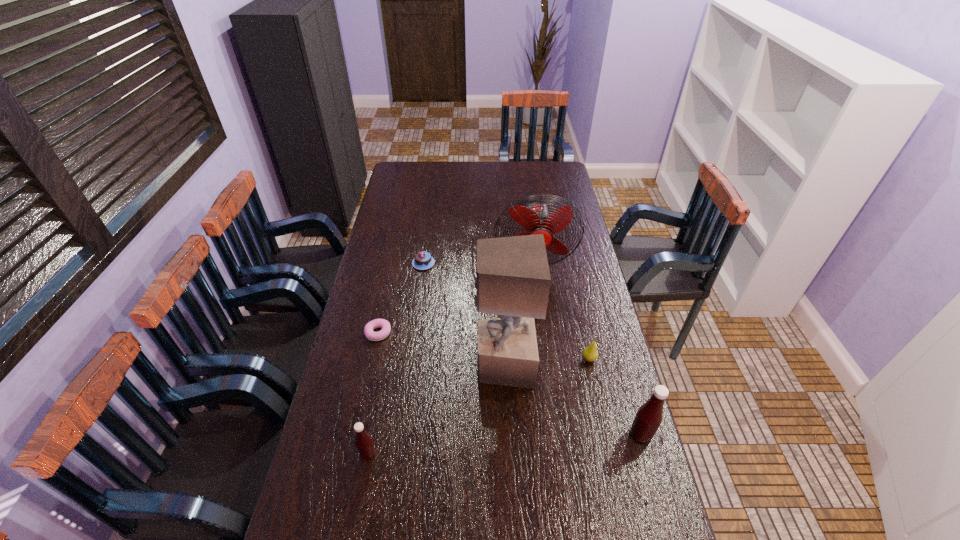
At what (x,y) coordinates should I click in order to perform the action: click on the nearest object. Please return your answer as a coordinate pair (x, y). Looking at the image, I should click on click(364, 443).

At what (x,y) coordinates should I click in order to perform the action: click on the fourth shortest object. Please return your answer as a coordinate pair (x, y). This screenshot has width=960, height=540. Looking at the image, I should click on (x=364, y=443).

The image size is (960, 540). Identify the location of the farther Tabasco sauce. (649, 416).

The height and width of the screenshot is (540, 960). In order to click on the fifth shortest object in this screenshot , I will do `click(649, 416)`.

The height and width of the screenshot is (540, 960). I want to click on the sixth shortest object, so click(536, 219).

Locate an element on the screen. The width and height of the screenshot is (960, 540). the fifth object from right to left is located at coordinates (422, 260).

The height and width of the screenshot is (540, 960). I want to click on chocolate cake, so click(422, 260).

Locate an element on the screen. This screenshot has height=540, width=960. pastry is located at coordinates 377,323.

You are a GUI agent. You are given a task and a screenshot of the screen. Output one action in this format:
    pyautogui.click(x=<x>, y=<y>)
    Task: Click on the tallest object
    This screenshot has width=960, height=540.
    Given the screenshot: What is the action you would take?
    pyautogui.click(x=513, y=280)

Where is `pear`? The image size is (960, 540). pear is located at coordinates (590, 353).